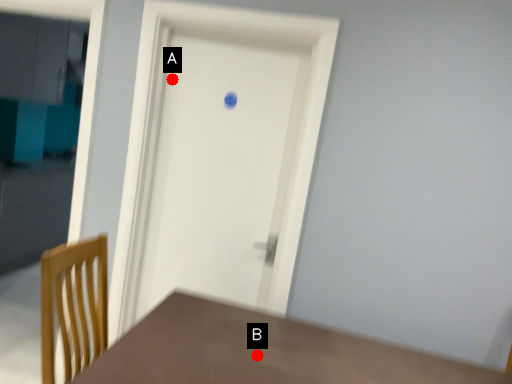
Question: Two points are circled on the image, labeled by A and B beside each circle. Which point appears closest to the camera in this image?

Choices:
 (A) A is closer
 (B) B is closer

Answer: (B)